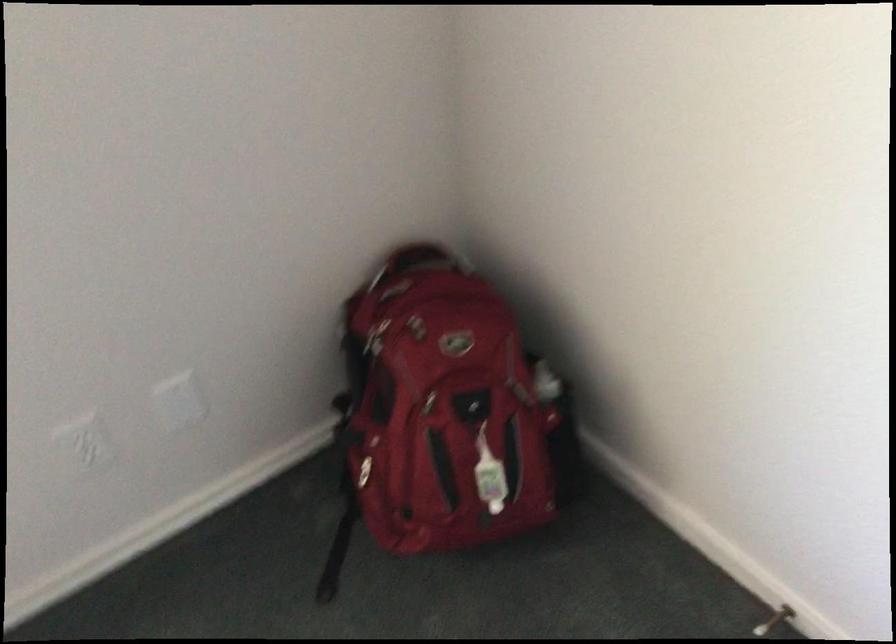
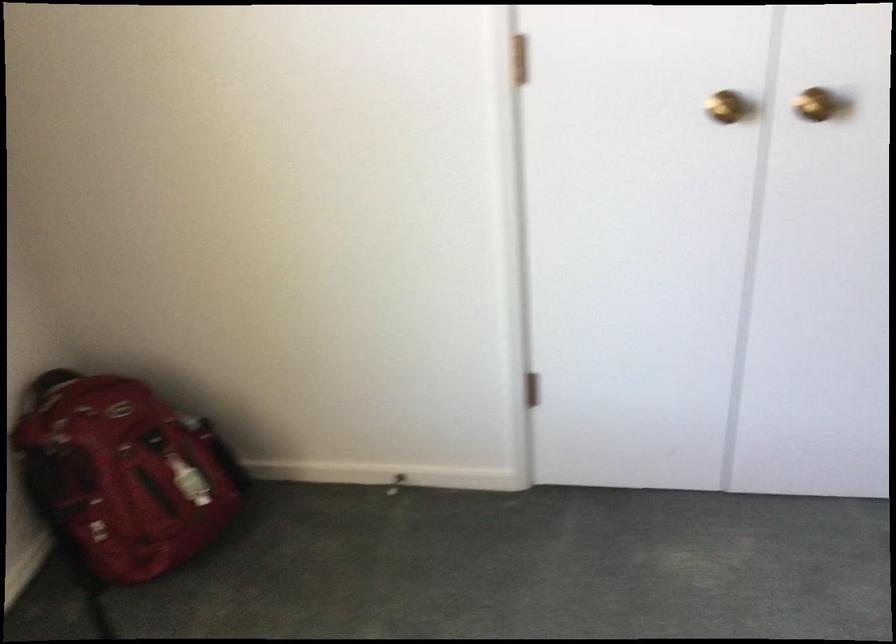
Locate, in the second image, the point that corresponds to (490,467) in the first image.

(188, 480)